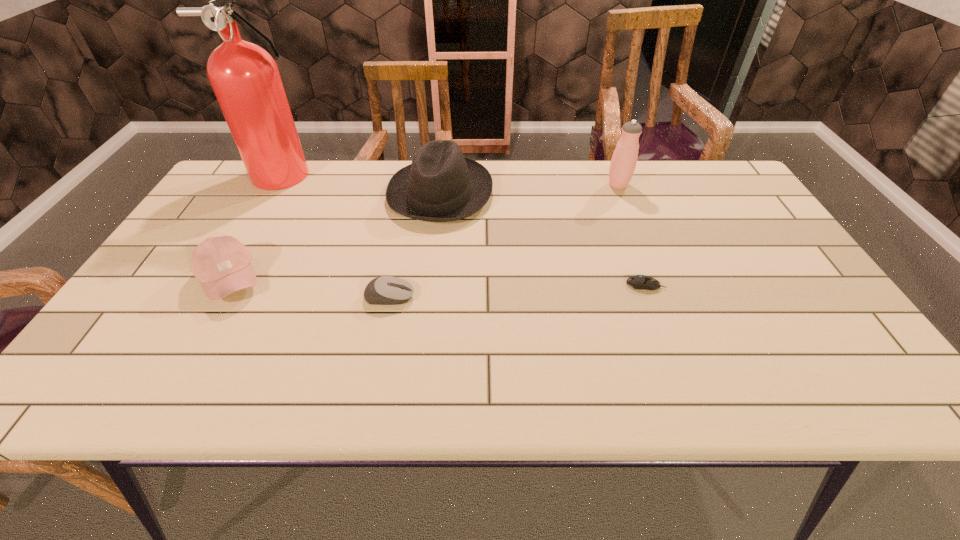
The width and height of the screenshot is (960, 540). Identify the location of vacant space at the far edge of the desktop. (512, 165).

Where is `vacant region at the near edge of the desktop`? Image resolution: width=960 pixels, height=540 pixels. vacant region at the near edge of the desktop is located at coordinates (734, 390).

Where is `free region at the left edge of the desktop`? This screenshot has height=540, width=960. free region at the left edge of the desktop is located at coordinates (138, 296).

I want to click on vacant area at the right edge of the desktop, so click(x=729, y=239).

The height and width of the screenshot is (540, 960). What are the coordinates of `free spot at the far left corner of the desktop` in the screenshot? It's located at (253, 201).

Locate an element on the screen. The height and width of the screenshot is (540, 960). vacant space at the far right corner of the desktop is located at coordinates (690, 167).

Image resolution: width=960 pixels, height=540 pixels. In order to click on vacant space that's between the fire extinguisher and the fourth tallest object in this screenshot , I will do `click(260, 227)`.

Find the location of `free spot between the baseball cap and the thermos bottle`. free spot between the baseball cap and the thermos bottle is located at coordinates (424, 232).

This screenshot has width=960, height=540. Find the location of `unoccupied position between the shorter computer mouse and the fedora`. unoccupied position between the shorter computer mouse and the fedora is located at coordinates coord(543,239).

Where is `free space between the fire extinguisher and the fedora`? Image resolution: width=960 pixels, height=540 pixels. free space between the fire extinguisher and the fedora is located at coordinates (366, 184).